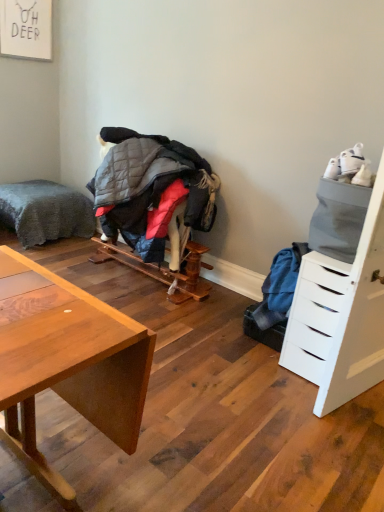
Question: Can you confirm if white matte drawer at right is wider than gray plush bed at left?

Choices:
 (A) no
 (B) yes

Answer: (A)

Question: Does white matte drawer at right turn towards gray plush bed at left?

Choices:
 (A) yes
 (B) no

Answer: (B)

Question: Is white matte drawer at right further to the viewer compared to gray plush bed at left?

Choices:
 (A) yes
 (B) no

Answer: (B)

Question: Does white matte drawer at right have a larger size compared to gray plush bed at left?

Choices:
 (A) yes
 (B) no

Answer: (B)

Question: Is white matte drawer at right at the left side of gray plush bed at left?

Choices:
 (A) no
 (B) yes

Answer: (A)

Question: Is white matte drawer at right positioned with its back to gray plush bed at left?

Choices:
 (A) no
 (B) yes

Answer: (A)

Question: Can you confirm if quilted gray jacket at center is wider than white matte drawer at right?

Choices:
 (A) yes
 (B) no

Answer: (B)

Question: From the image's perspective, is quilted gray jacket at center located beneath white matte drawer at right?

Choices:
 (A) no
 (B) yes

Answer: (A)

Question: From a real-world perspective, does quilted gray jacket at center stand above white matte drawer at right?

Choices:
 (A) no
 (B) yes

Answer: (B)

Question: Is quilted gray jacket at center further to camera compared to white matte drawer at right?

Choices:
 (A) no
 (B) yes

Answer: (B)

Question: Is quilted gray jacket at center placed right next to white matte drawer at right?

Choices:
 (A) no
 (B) yes

Answer: (A)

Question: Is quilted gray jacket at center at the left side of white matte drawer at right?

Choices:
 (A) no
 (B) yes

Answer: (B)

Question: Considering the relative positions of gray plush bed at left and quilted gray jacket at center in the image provided, is gray plush bed at left in front of quilted gray jacket at center?

Choices:
 (A) no
 (B) yes

Answer: (A)